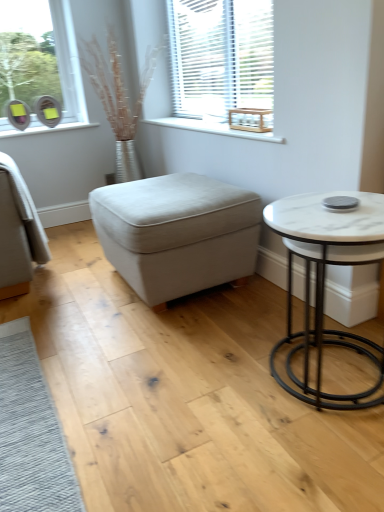
Question: From a real-world perspective, is white wood at upper center over beige fabric ottoman at center?

Choices:
 (A) yes
 (B) no

Answer: (A)

Question: Considering the relative sizes of white wood at upper center and beige fabric ottoman at center in the image provided, is white wood at upper center shorter than beige fabric ottoman at center?

Choices:
 (A) no
 (B) yes

Answer: (B)

Question: Is beige fabric ottoman at center located within white wood at upper center?

Choices:
 (A) no
 (B) yes

Answer: (A)

Question: Can you confirm if white wood at upper center is positioned to the right of beige fabric ottoman at center?

Choices:
 (A) yes
 (B) no

Answer: (A)

Question: Is white wood at upper center positioned behind beige fabric ottoman at center?

Choices:
 (A) yes
 (B) no

Answer: (A)

Question: Can you confirm if white wood at upper center is bigger than beige fabric ottoman at center?

Choices:
 (A) no
 (B) yes

Answer: (A)

Question: Would you say beige fabric ottoman at center contains white wood at upper center?

Choices:
 (A) no
 (B) yes

Answer: (A)

Question: Does beige fabric ottoman at center have a greater height compared to white wood at upper center?

Choices:
 (A) yes
 (B) no

Answer: (A)

Question: Is beige fabric ottoman at center closer to camera compared to white wood at upper center?

Choices:
 (A) yes
 (B) no

Answer: (A)

Question: From the image's perspective, is beige fabric ottoman at center on white wood at upper center?

Choices:
 (A) no
 (B) yes

Answer: (A)

Question: Is beige fabric ottoman at center oriented away from white wood at upper center?

Choices:
 (A) no
 (B) yes

Answer: (A)

Question: Considering the relative positions of beige fabric ottoman at center and white wood at upper center in the image provided, is beige fabric ottoman at center to the left of white wood at upper center from the viewer's perspective?

Choices:
 (A) no
 (B) yes

Answer: (B)

Question: Can you confirm if beige fabric ottoman at center is bigger than white marble table at right?

Choices:
 (A) no
 (B) yes

Answer: (B)